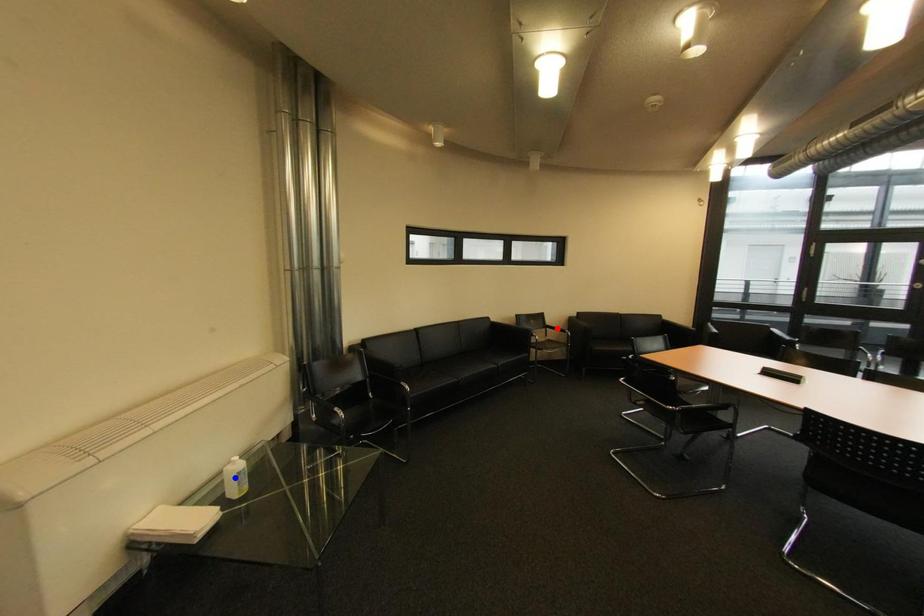
Question: Two points are marked on the image. Which point is closer to the camera?

Choices:
 (A) Blue point is closer.
 (B) Red point is closer.

Answer: (A)